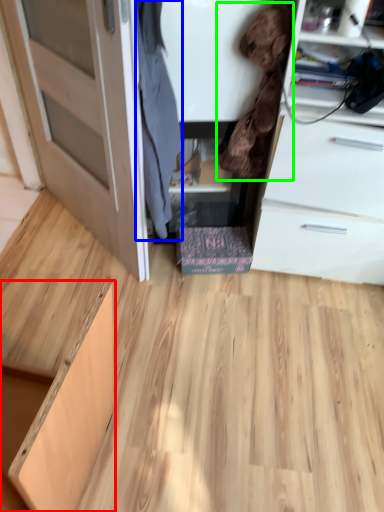
Question: Which object is positioned farthest from cabinetry (highlighted by a red box)? Select from clothing (highlighted by a blue box) and clothing (highlighted by a green box).

Choices:
 (A) clothing
 (B) clothing

Answer: (B)